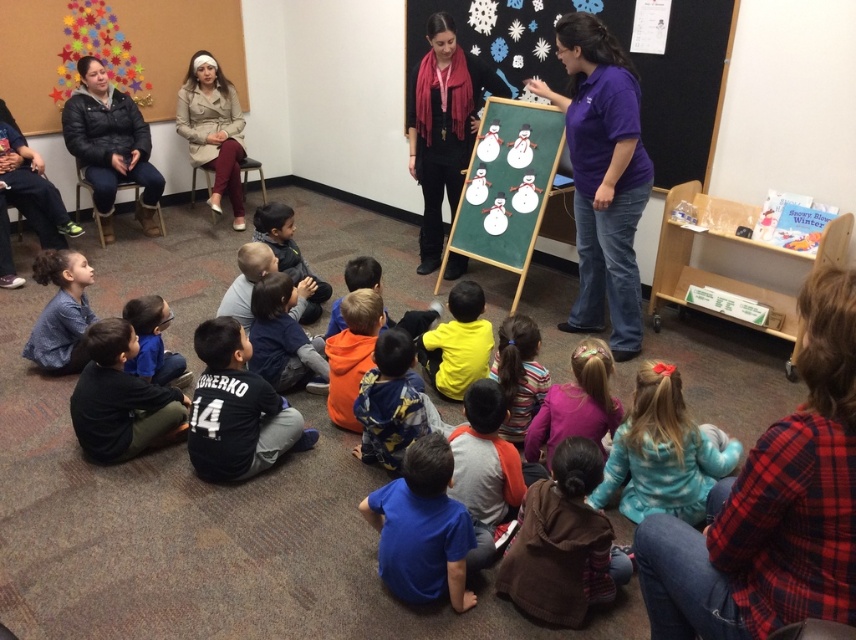
Question: Which object is positioned closest to the blue fleece jacket at lower left?

Choices:
 (A) black matte scarf at center
 (B) brown fuzzy sweater at lower center
 (C) blue shirt at center

Answer: (C)

Question: Is the position of beige trench coat at upper left less distant than that of purple fleece jacket at lower center?

Choices:
 (A) yes
 (B) no

Answer: (B)

Question: Can you confirm if blue polka dot shirt at lower center is smaller than black jersey at center?

Choices:
 (A) yes
 (B) no

Answer: (B)

Question: Which point is farther to the camera?

Choices:
 (A) orange fleece jacket at center
 (B) black puffy jacket at upper left

Answer: (B)

Question: Which of these objects is positioned closest to the brown fuzzy sweater at lower center?

Choices:
 (A) black matte scarf at center
 (B) blue fleece jacket at lower left
 (C) blue polka dot shirt at lower center
 (D) black puffy jacket at upper left

Answer: (C)

Question: Is blue polka dot shirt at lower center above purple fleece jacket at lower center?

Choices:
 (A) yes
 (B) no

Answer: (B)